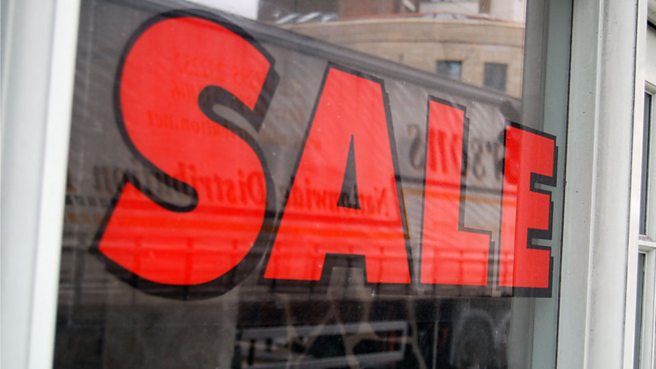
The width and height of the screenshot is (656, 369). Find the location of `sides of window`. sides of window is located at coordinates (579, 201), (44, 212).